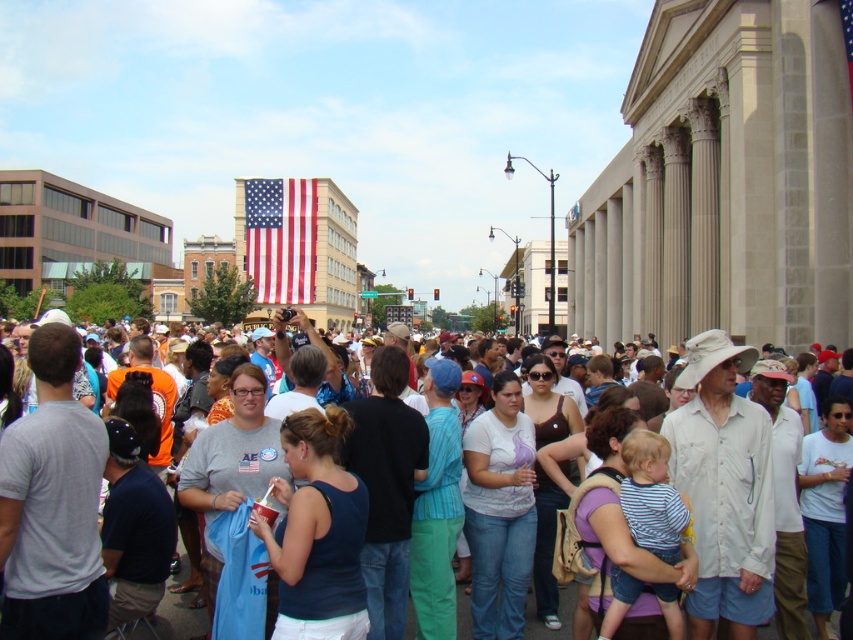
Question: Which point is closer to the camera?

Choices:
 (A) (161, 636)
 (B) (306, 300)

Answer: (A)

Question: Observing the image, what is the correct spatial positioning of red-white-and-blue fabric flag at upper center in reference to american flag at upper center?

Choices:
 (A) above
 (B) below

Answer: (B)

Question: Is red-white-and-blue fabric flag at upper center wider than white cotton shirt at center?

Choices:
 (A) no
 (B) yes

Answer: (A)

Question: Based on their relative distances, which object is farther from the white cotton shirt at center?

Choices:
 (A) american flag at upper center
 (B) red-white-and-blue fabric flag at upper center

Answer: (B)

Question: In this image, where is red-white-and-blue fabric flag at upper center located relative to american flag at upper center?

Choices:
 (A) right
 (B) left

Answer: (B)

Question: Which point appears farthest from the camera in this image?

Choices:
 (A) (279, 186)
 (B) (842, 28)
 (C) (465, 616)

Answer: (A)